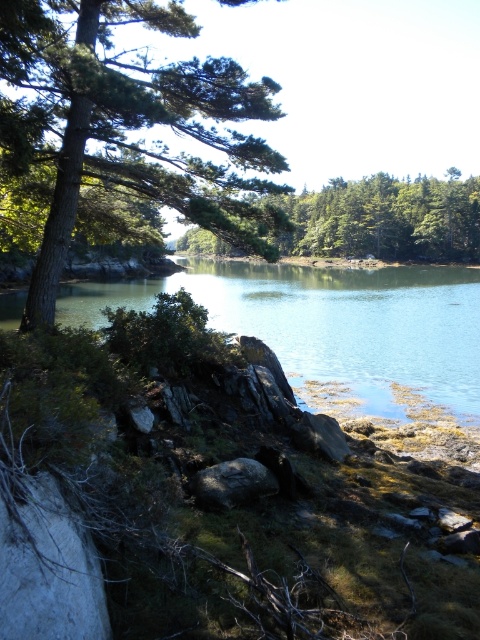
Does point (248, 116) come farther from viewer compared to point (331, 209)?

No, (248, 116) is in front of (331, 209).

This screenshot has height=640, width=480. What are the coordinates of `green textured tree at upper left` in the screenshot? It's located at (128, 124).

Does point (233, 115) come farther from viewer compared to point (347, 234)?

No, it is not.

Locate an element on the screen. Image resolution: width=480 pixels, height=640 pixels. green textured tree at upper left is located at coordinates pyautogui.click(x=128, y=124).

In the scene shown: Is green textured tree at upper left smaller than clear water at center?

Indeed, green textured tree at upper left has a smaller size compared to clear water at center.

You are a GUI agent. You are given a task and a screenshot of the screen. Output one action in this format:
    pyautogui.click(x=<x>, y=<y>)
    Task: Click on the green textured tree at upper left
    Image resolution: width=480 pixels, height=640 pixels.
    Given the screenshot: What is the action you would take?
    pyautogui.click(x=128, y=124)

Locate an element on the screen. The image size is (480, 640). green textured tree at upper left is located at coordinates (128, 124).

Describe the element at coordinates (330, 323) in the screenshot. This screenshot has height=640, width=480. I see `clear water at center` at that location.

Who is more forward, [302,336] or [224,504]?

Point [224,504] is in front.

From the picture: Who is more distant from viewer, (242, 321) or (193, 488)?

Point (242, 321)

Identify the location of clear water at center. This screenshot has height=640, width=480. (330, 323).